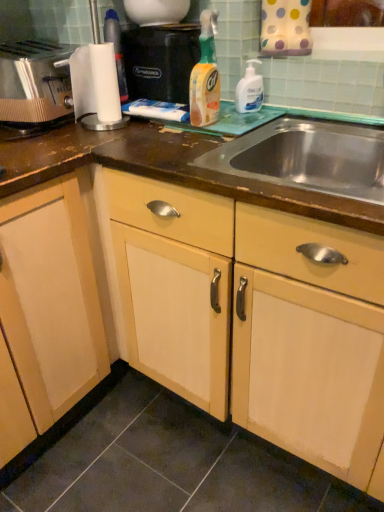
Image resolution: width=384 pixels, height=512 pixels. Identify the location of free spot to the right of translucent plastic spray bottle at center, arranged as the first cleaning product when viewed from the left. (240, 120).